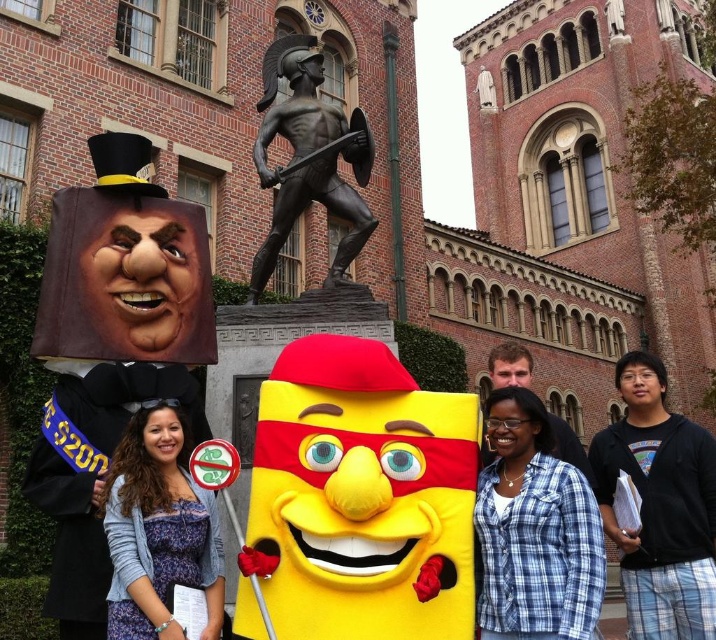
You are organizing a photo shoot and need to ensure that the blue plaid shirt at lower right and the matte purple dress at center are visible in the frame. Given their sizes, which one might require more space to accommodate in the composition?

The blue plaid shirt at lower right is bigger than the matte purple dress at center, so it would require more space to accommodate in the composition.

Looking at this image, you are standing at the point with coordinates point (x=364, y=228) and want to walk towards the point with coordinates point (x=574, y=536). Which direction should you move?

You should move forward because point (x=574, y=536) is in front of point (x=364, y=228).

What is located at the coordinate point (536, 529) in the image?

The blue plaid shirt at lower right is located at the coordinate point (536, 529).